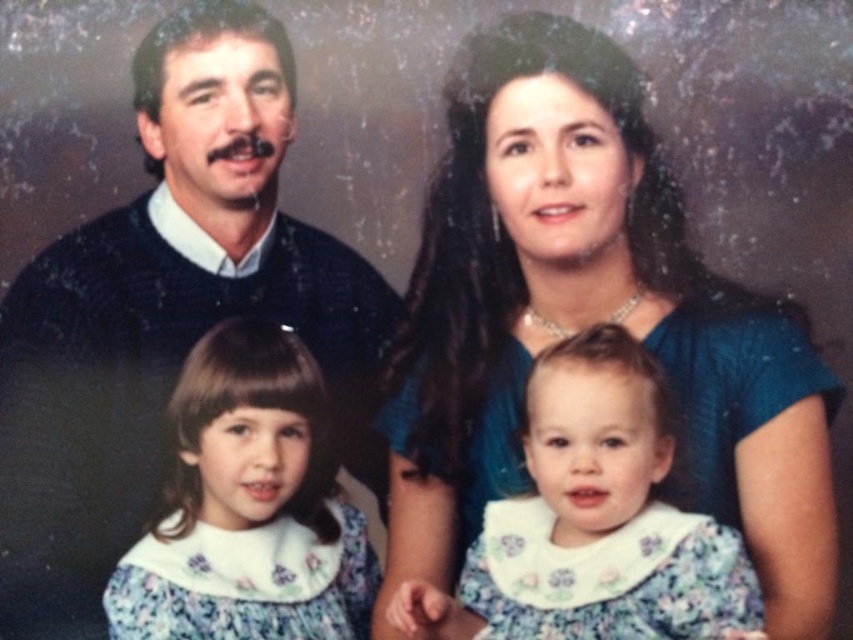
Question: Considering the relative positions of knitted sweater at upper left and floral fabric dress at center in the image provided, where is knitted sweater at upper left located with respect to floral fabric dress at center?

Choices:
 (A) left
 (B) right

Answer: (A)

Question: Can you confirm if blue satin dress at upper center is smaller than knitted sweater at upper left?

Choices:
 (A) no
 (B) yes

Answer: (A)

Question: Based on their relative distances, which object is farther from the blue satin dress at upper center?

Choices:
 (A) floral fabric dress at center
 (B) floral fabric dress at lower left
 (C) knitted sweater at upper left

Answer: (C)

Question: Which point is closer to the camera taking this photo?

Choices:
 (A) (187, 552)
 (B) (445, 358)

Answer: (A)

Question: Does blue satin dress at upper center come in front of floral fabric dress at center?

Choices:
 (A) no
 (B) yes

Answer: (A)

Question: Which point appears closest to the camera in this image?

Choices:
 (A) (734, 538)
 (B) (97, 600)
 (C) (718, 369)

Answer: (A)